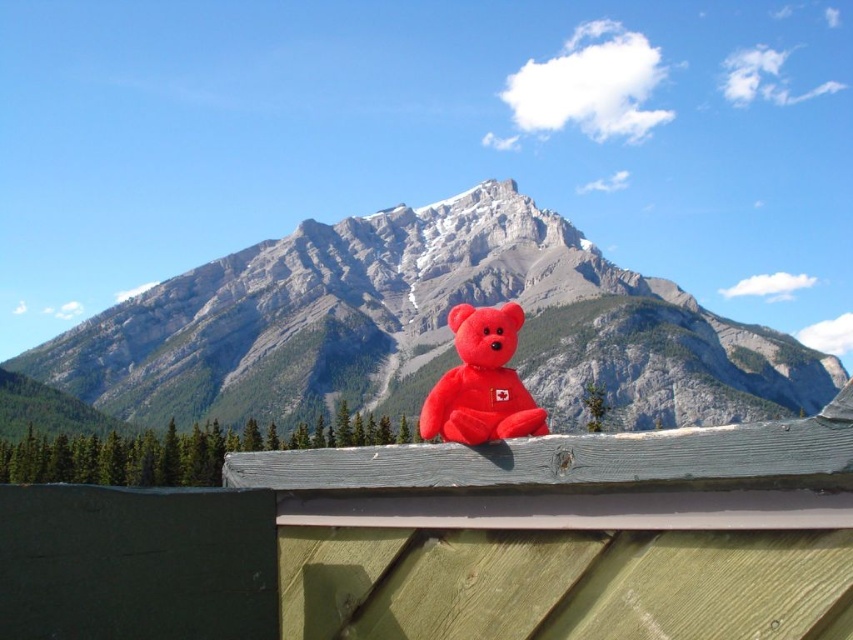
Question: Which point is farther from the camera taking this photo?

Choices:
 (A) (502, 396)
 (B) (231, 348)
 (C) (447, 504)

Answer: (B)

Question: Is wooden at center above matte red teddy bear at center?

Choices:
 (A) no
 (B) yes

Answer: (A)

Question: Observing the image, what is the correct spatial positioning of wooden at center in reference to matte red teddy bear at center?

Choices:
 (A) right
 (B) left

Answer: (A)

Question: Is matte red teddy bear at center thinner than matte plush bear at center?

Choices:
 (A) yes
 (B) no

Answer: (B)

Question: Which point is farther from the camera taking this photo?

Choices:
 (A) (492, 397)
 (B) (234, 262)
 (C) (343, 474)

Answer: (B)

Question: Based on their relative distances, which object is nearer to the matte plush bear at center?

Choices:
 (A) matte red teddy bear at center
 (B) wooden at center

Answer: (B)